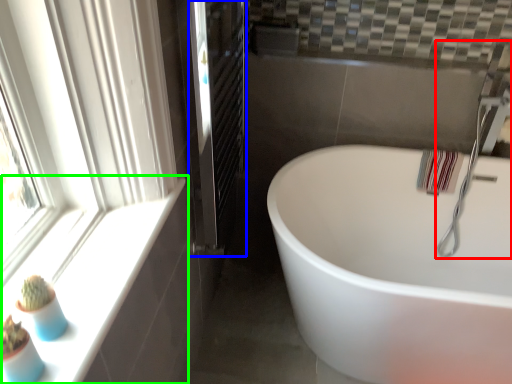
Question: Which is nearer to the faucet (highlighted by a red box)? screen door (highlighted by a blue box) or window sill (highlighted by a green box).

Choices:
 (A) screen door
 (B) window sill

Answer: (A)